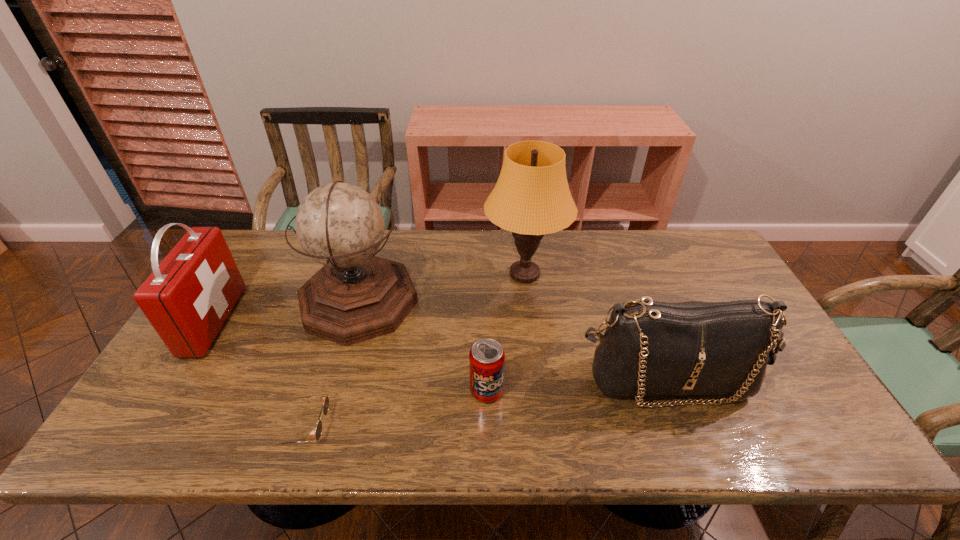
Identify the location of vacant space at the far left corner. (264, 242).

The height and width of the screenshot is (540, 960). I want to click on empty location between the globe and the soda can, so click(x=422, y=346).

Where is `vacant space that's between the handbag and the lampshade`? This screenshot has height=540, width=960. vacant space that's between the handbag and the lampshade is located at coordinates (596, 327).

The width and height of the screenshot is (960, 540). In order to click on free space between the lampshade and the handbag in this screenshot , I will do `click(596, 327)`.

This screenshot has width=960, height=540. Identify the location of vacant space that's between the first-aid kit and the shortest object. (259, 374).

The height and width of the screenshot is (540, 960). Identify the location of blank region between the handbag and the lampshade. (596, 327).

Find the location of a particular element. unoccupied area between the lampshade and the handbag is located at coordinates (596, 327).

Identify the location of free spot between the soda can and the shortest object. This screenshot has width=960, height=540. (396, 409).

The image size is (960, 540). Find the location of `unoccupied position between the sunglasses and the globe`. unoccupied position between the sunglasses and the globe is located at coordinates (332, 364).

What are the coordinates of `vacant point located between the leftmost object and the handbag` in the screenshot? It's located at (441, 350).